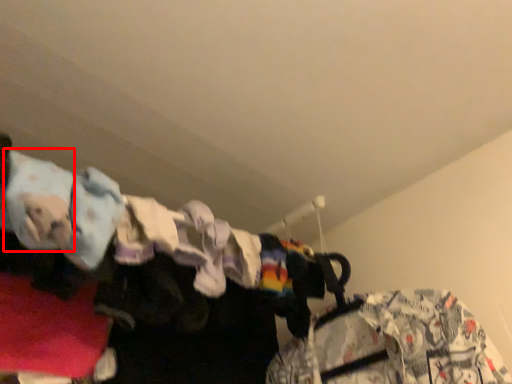
Question: From the image, what is the correct spatial relationship of clothing (annotated by the red box) in relation to clothing?

Choices:
 (A) right
 (B) left

Answer: (B)